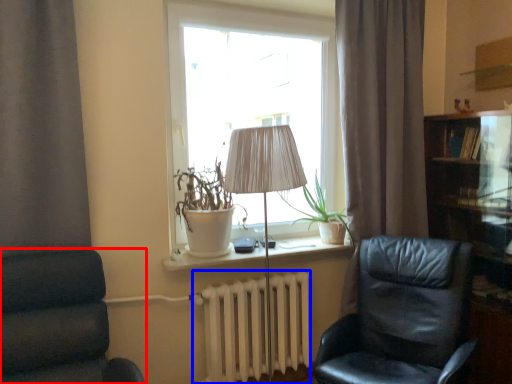
Question: Among these objects, which one is farthest to the camera, chair (highlighted by a red box) or radiator (highlighted by a blue box)?

Choices:
 (A) chair
 (B) radiator

Answer: (B)